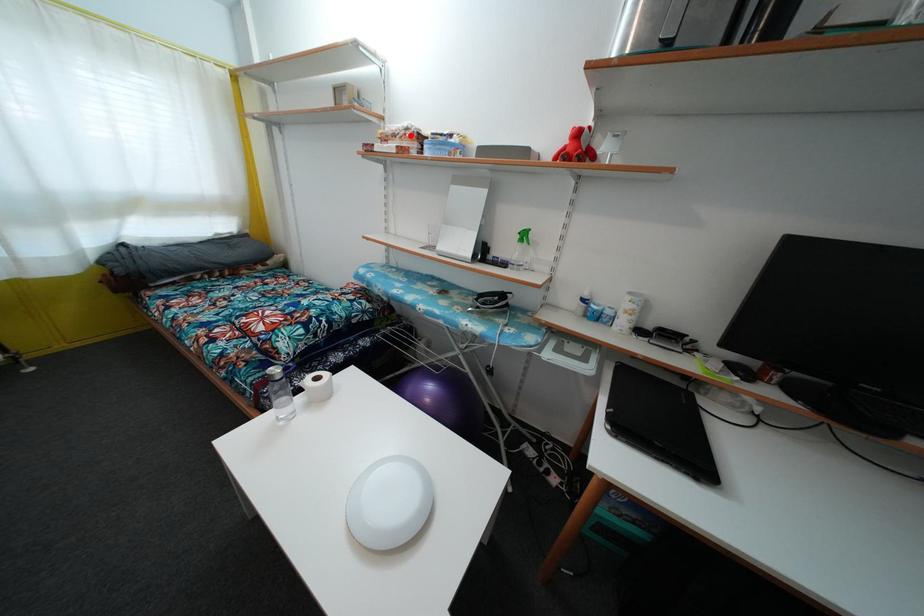
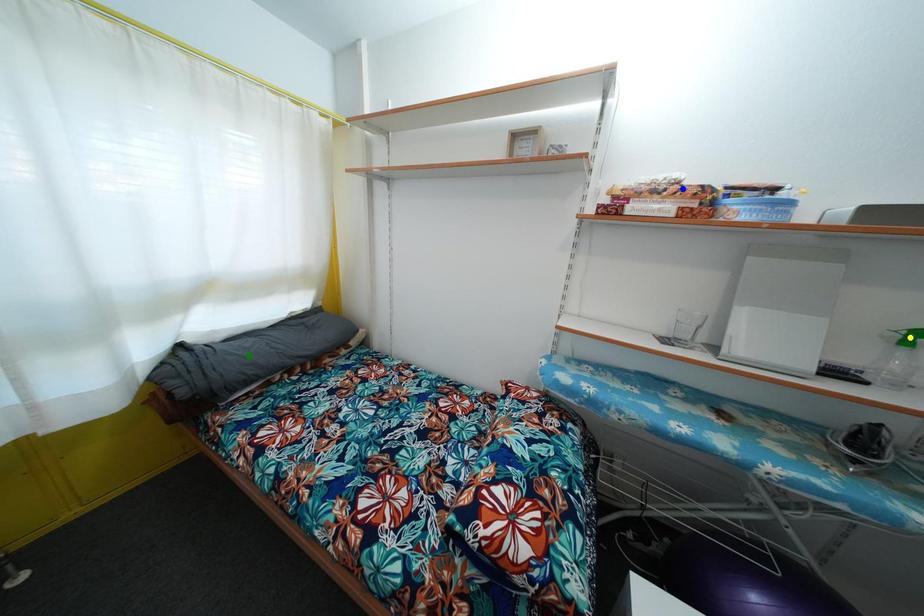
Question: I am providing you with two images of the same scene from different viewpoints. A red point is marked on the first image. You are given multiple points on the second image. Which point in image 2 is actually the same real-world point as the red point in image 1?

Choices:
 (A) blue point
 (B) yellow point
 (C) green point

Answer: (A)